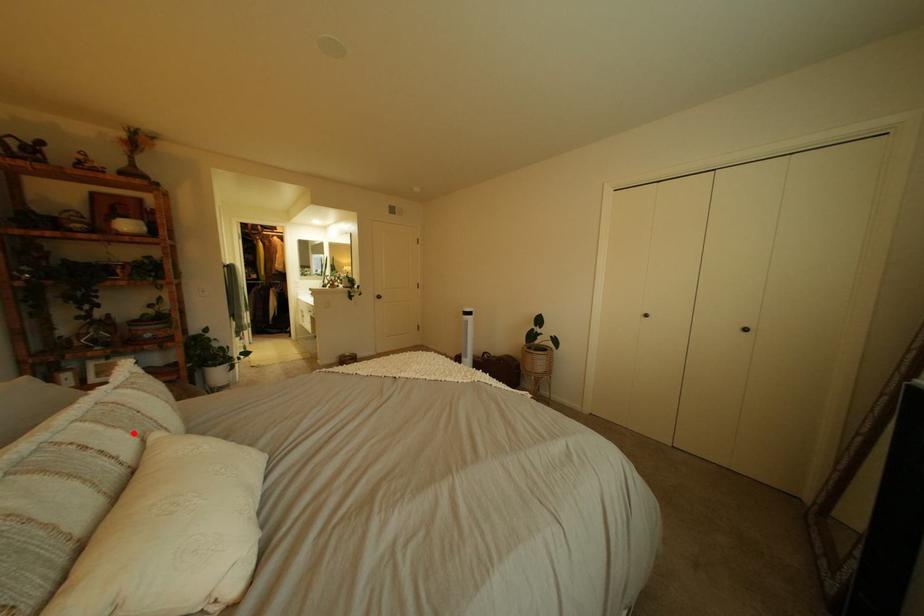
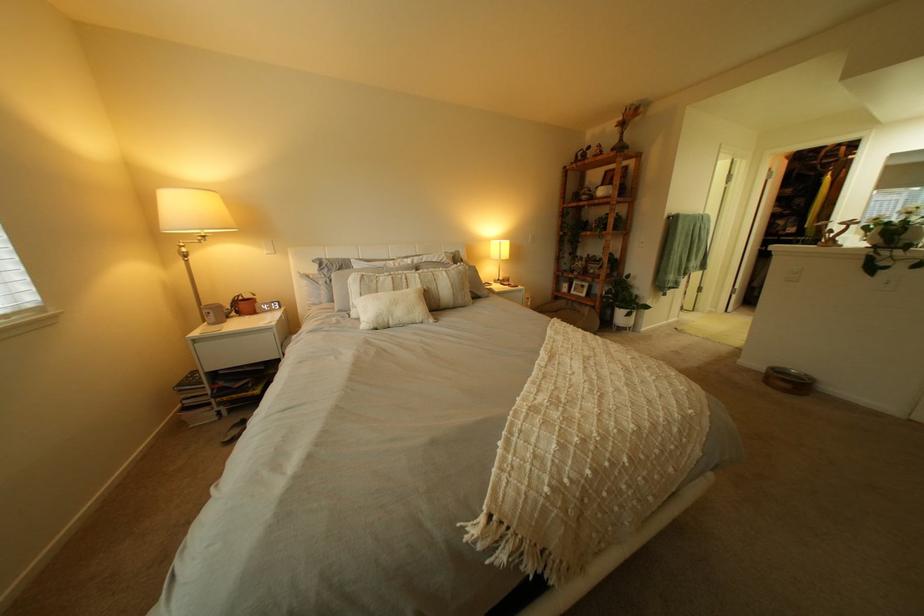
Locate, in the second image, the point that corresponds to the highlighted location in the first image.

(434, 283)